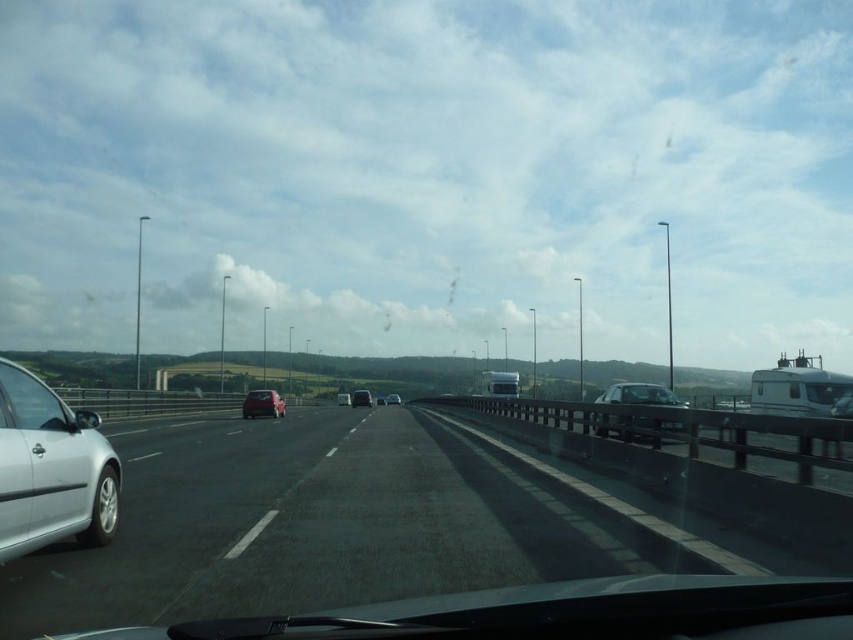
You are a passenger in the vehicle and want to know which of the two points, point (219, 451) or point (265, 392), is closer to you. Based on the scene description, can you determine which point is nearer?

Point (219, 451) is closer to the viewer than point (265, 392).

You are driving a car and want to know if the smooth asphalt highway at center is wider than the clear glass windshield at left. Can you confirm this using the information provided?

The smooth asphalt highway at center is wider than the clear glass windshield at left according to the description.